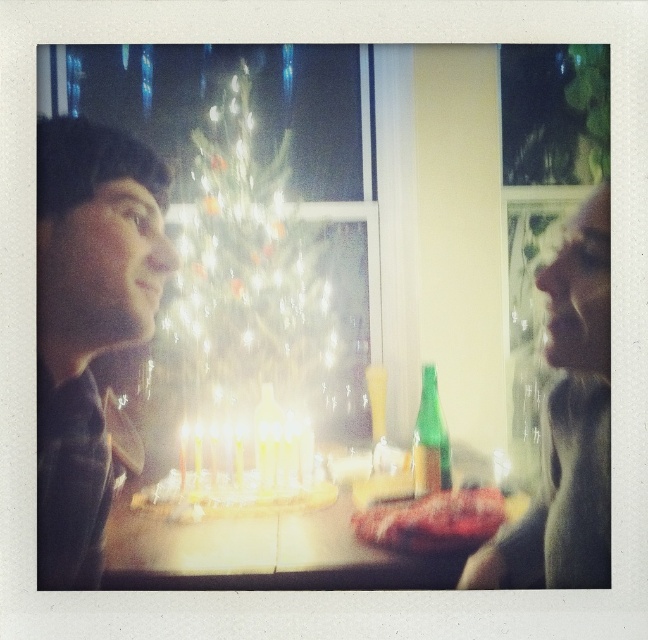
You are planning to place a rectangular gift box on the table. The gift box is as wide as the matte black shirt at left. Will it fit on the white glossy table at center without overhanging the edges?

The matte black shirt at left is thinner than the white glossy table at center. Since the gift box is as wide as the matte black shirt at left, it will fit on the white glossy table at center without overhanging the edges because the table is wider than the shirt.

Consider the image. You are standing in the room and want to move from the point at coordinates point (49, 416) to the point at coordinates point (426, 417). Can you walk directly between them without any obstacles?

Point (49, 416) is in front of point (426, 417), so there is an obstacle blocking the path between them.

You are standing in the room where the birthday celebration is happening. You need to locate the matte black shirt at left. Where is it positioned in the room?

The matte black shirt at left is located at the 2D coordinates point (87, 323) in the room.